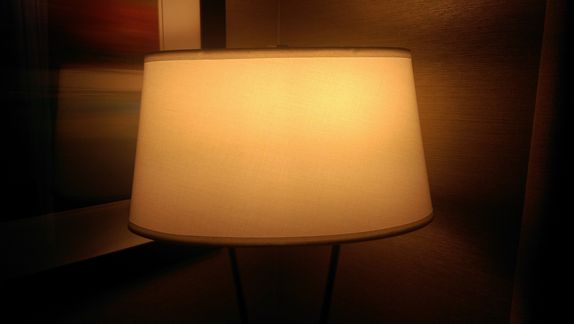
Image resolution: width=574 pixels, height=324 pixels. I want to click on painting, so click(200, 33).